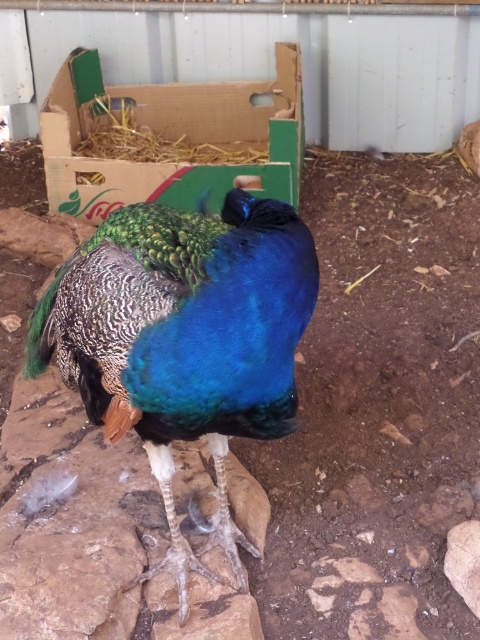
Question: Which object appears closest to the camera in this image?

Choices:
 (A) cardboard box at upper center
 (B) straw hay at upper center
 (C) shiny blue peacock at center

Answer: (C)

Question: Observing the image, what is the correct spatial positioning of cardboard box at upper center in reference to straw hay at upper center?

Choices:
 (A) above
 (B) below

Answer: (B)

Question: Estimate the real-world distances between objects in this image. Which object is farther from the cardboard box at upper center?

Choices:
 (A) shiny blue peacock at center
 (B) straw hay at upper center

Answer: (A)

Question: Does cardboard box at upper center appear on the right side of straw hay at upper center?

Choices:
 (A) no
 (B) yes

Answer: (B)

Question: Does cardboard box at upper center lie behind straw hay at upper center?

Choices:
 (A) no
 (B) yes

Answer: (A)

Question: Which point is farther to the camera?

Choices:
 (A) 170,364
 (B) 74,154

Answer: (B)